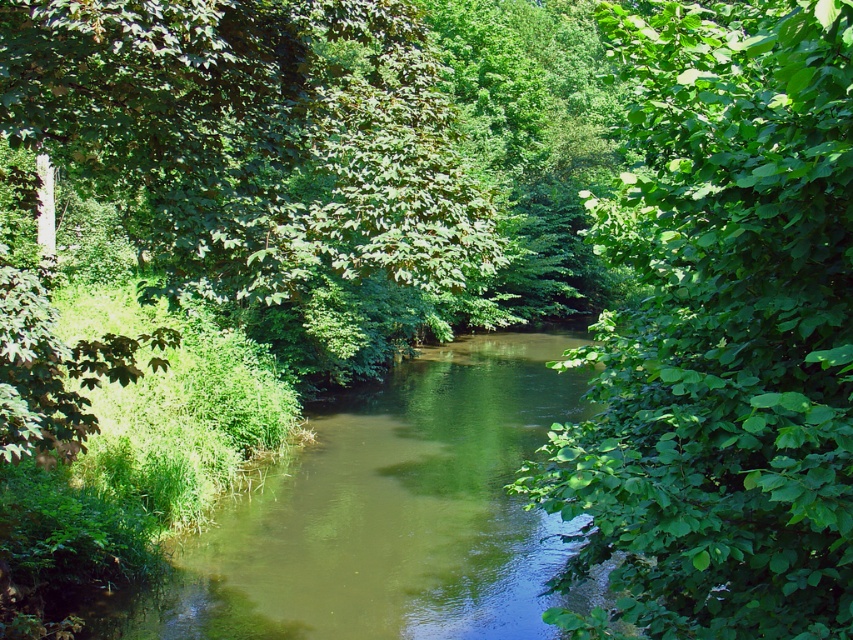
Is green leafy tree at upper left positioned before green smooth water at center?

Yes, green leafy tree at upper left is in front of green smooth water at center.

Identify the location of green leafy tree at upper left. (253, 138).

Measure the distance between green leafy tree at upper left and camera.

green leafy tree at upper left and camera are 4.53 meters apart from each other.

This screenshot has height=640, width=853. In order to click on green leafy tree at upper left in this screenshot , I will do `click(253, 138)`.

Locate an element on the screen. The height and width of the screenshot is (640, 853). green leafy tree at center right is located at coordinates (721, 333).

Between green leafy tree at center right and green smooth water at center, which one has more height?

With more height is green leafy tree at center right.

Is point (764, 413) farther from viewer compared to point (419, 497)?

No, it is in front of (419, 497).

Find the location of `green leafy tree at center right`. green leafy tree at center right is located at coordinates (721, 333).

Does green leafy tree at center right appear over green leafy tree at upper left?

Yes.

Which is above, green leafy tree at center right or green leafy tree at upper left?

green leafy tree at center right

Between point (740, 516) and point (97, 150), which one is positioned behind?

The point (97, 150) is behind.

You are a GUI agent. You are given a task and a screenshot of the screen. Output one action in this format:
    pyautogui.click(x=<x>, y=<y>)
    Task: Click on the green leafy tree at center right
    
    Given the screenshot: What is the action you would take?
    pyautogui.click(x=721, y=333)